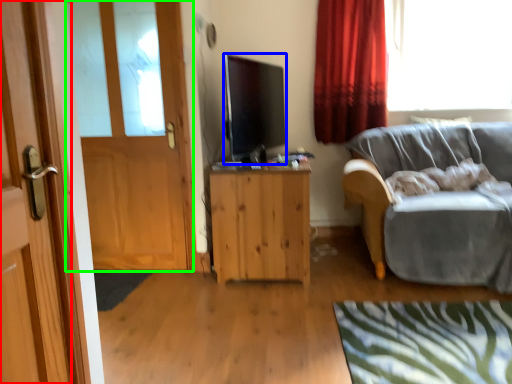
Question: Considering the real-world distances, which object is closest to door (highlighted by a red box)? television (highlighted by a blue box) or door (highlighted by a green box).

Choices:
 (A) television
 (B) door

Answer: (B)